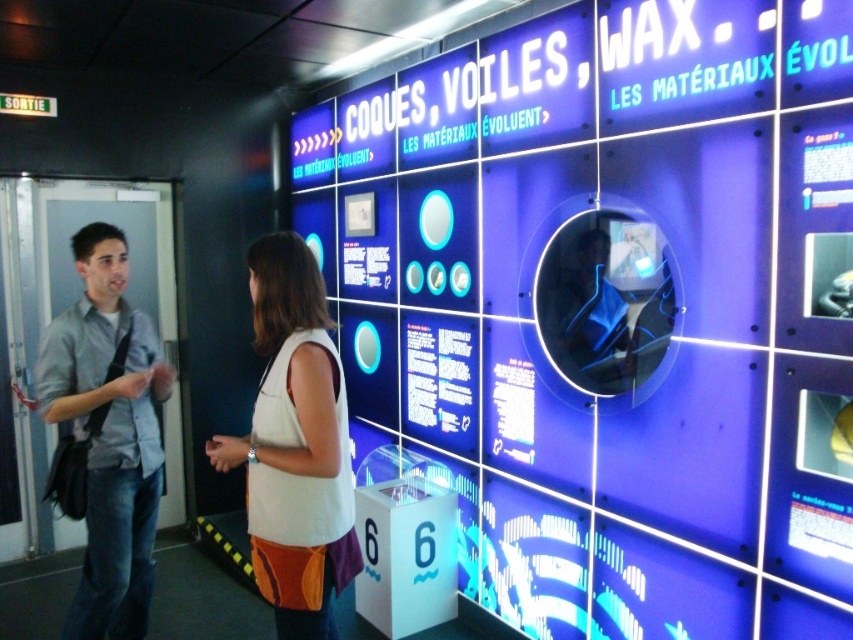
Question: Does white fabric dress at center appear over light blue shirt at left?

Choices:
 (A) yes
 (B) no

Answer: (A)

Question: Which of the following is the closest to the observer?

Choices:
 (A) light blue shirt at left
 (B) white fabric dress at center

Answer: (B)

Question: Which of the following is the closest to the observer?

Choices:
 (A) light blue shirt at left
 (B) white fabric dress at center

Answer: (B)

Question: Can you confirm if white fabric dress at center is positioned to the right of light blue shirt at left?

Choices:
 (A) yes
 (B) no

Answer: (A)

Question: Which object appears closest to the camera in this image?

Choices:
 (A) light blue shirt at left
 (B) white fabric dress at center

Answer: (B)

Question: In this image, where is white fabric dress at center located relative to light blue shirt at left?

Choices:
 (A) left
 (B) right

Answer: (B)